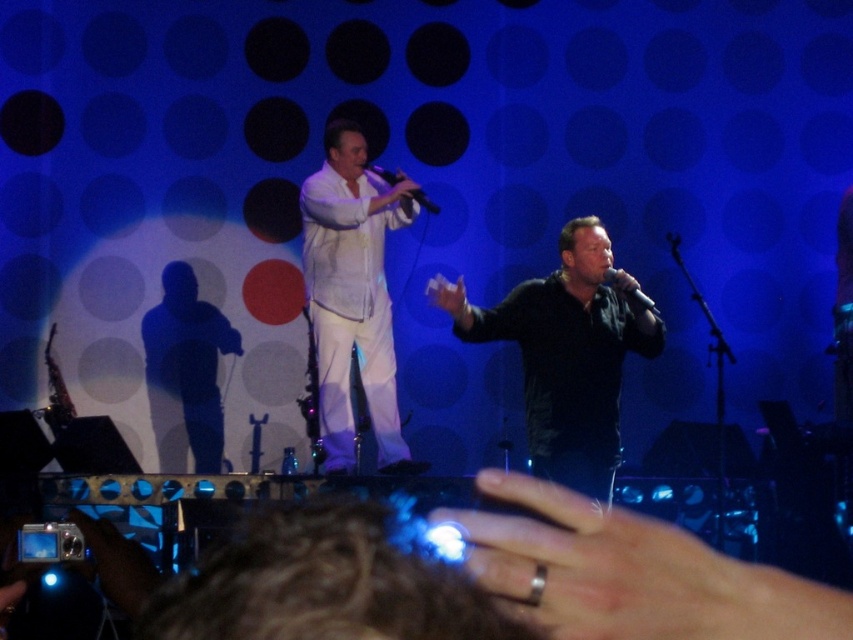
Question: Is black matte shirt at center below white sheer shirt at center?

Choices:
 (A) no
 (B) yes

Answer: (B)

Question: Does black matte shirt at center appear on the right side of matte black microphone at center?

Choices:
 (A) yes
 (B) no

Answer: (A)

Question: Which point appears farthest from the camera in this image?

Choices:
 (A) [x=544, y=333]
 (B) [x=206, y=429]

Answer: (B)

Question: Does black matte shirt at center have a larger size compared to black matte shadow at left?

Choices:
 (A) yes
 (B) no

Answer: (A)

Question: Which of the following is the closest to the observer?

Choices:
 (A) black matte shadow at left
 (B) black matte shirt at center

Answer: (B)

Question: Which is nearer to the matte black microphone at center?

Choices:
 (A) black matte shirt at center
 (B) black matte shadow at left

Answer: (A)